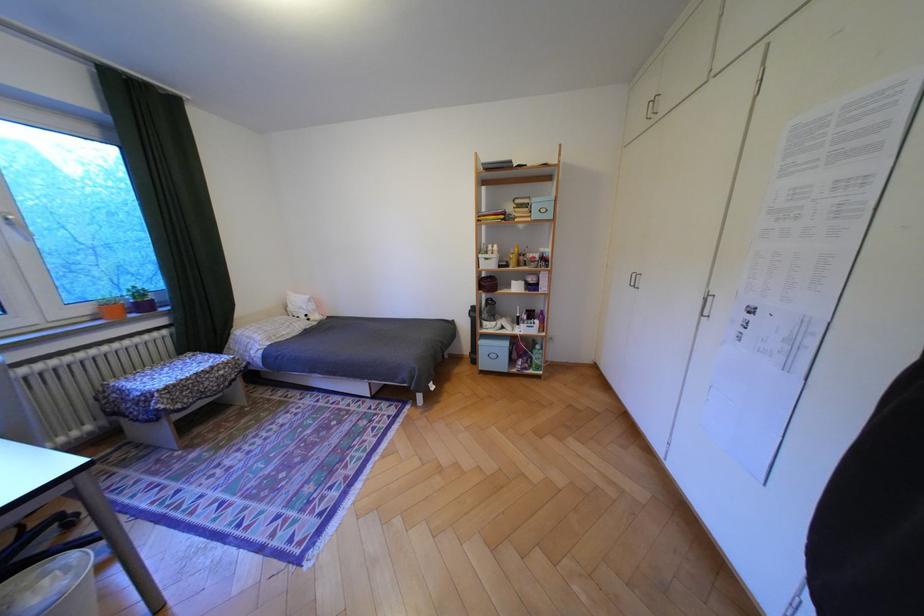
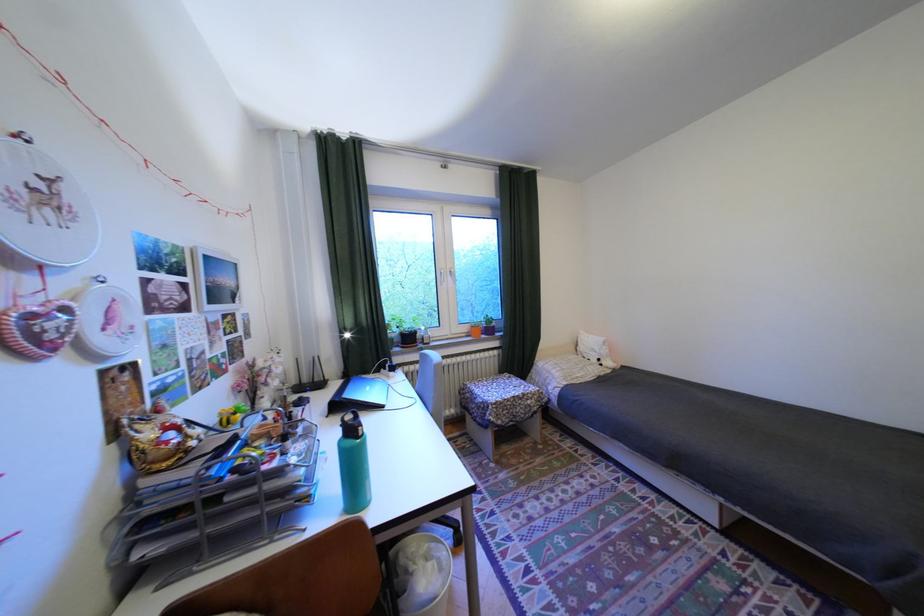
Where in the second image is the point corresponding to the point at 190,406 from the first image?

(512, 422)